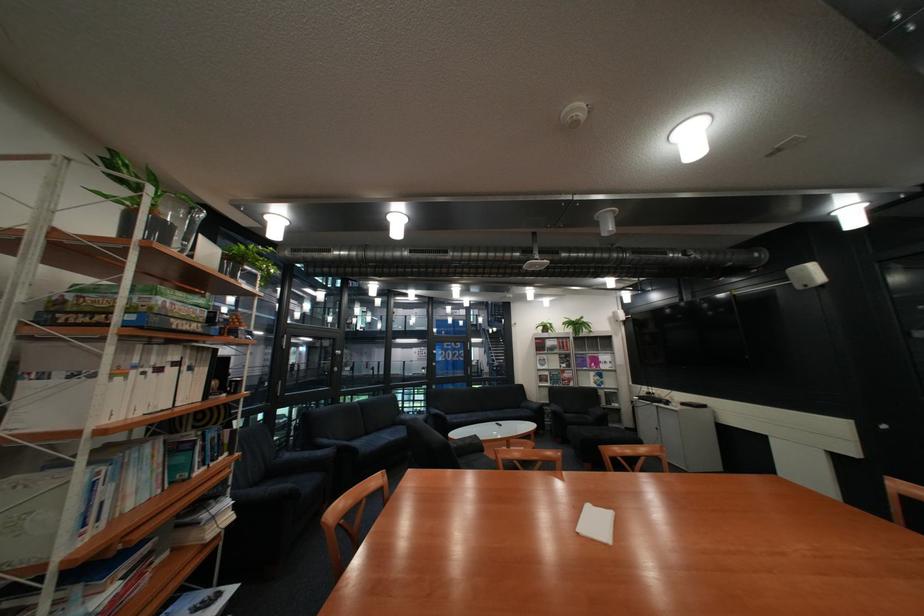
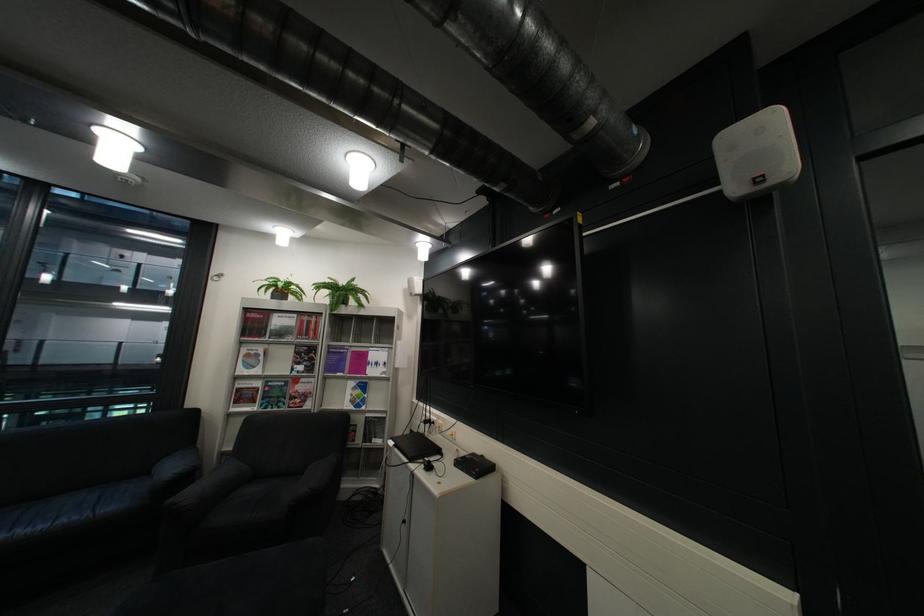
Locate, in the second image, the point that corresponds to (x=555, y=376) in the first image.

(254, 390)